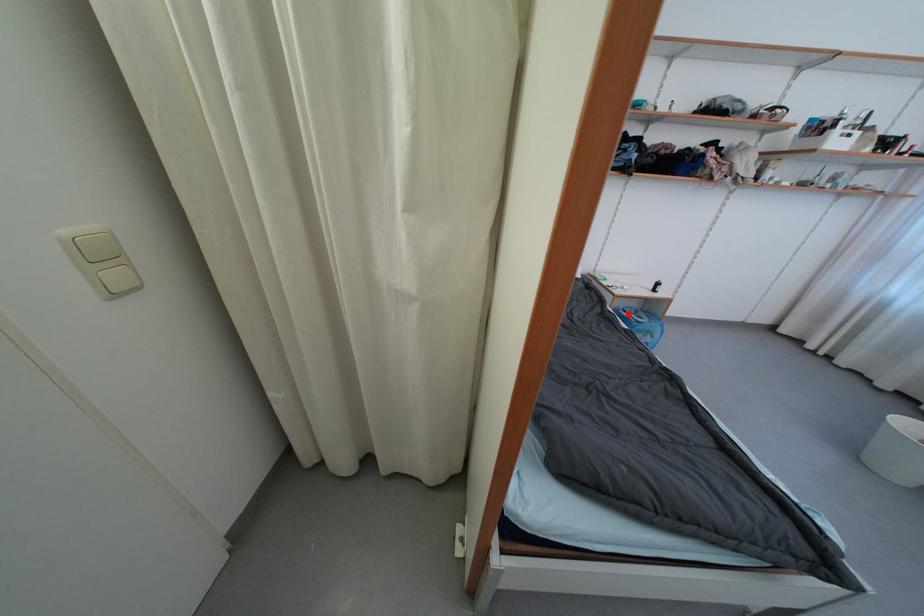
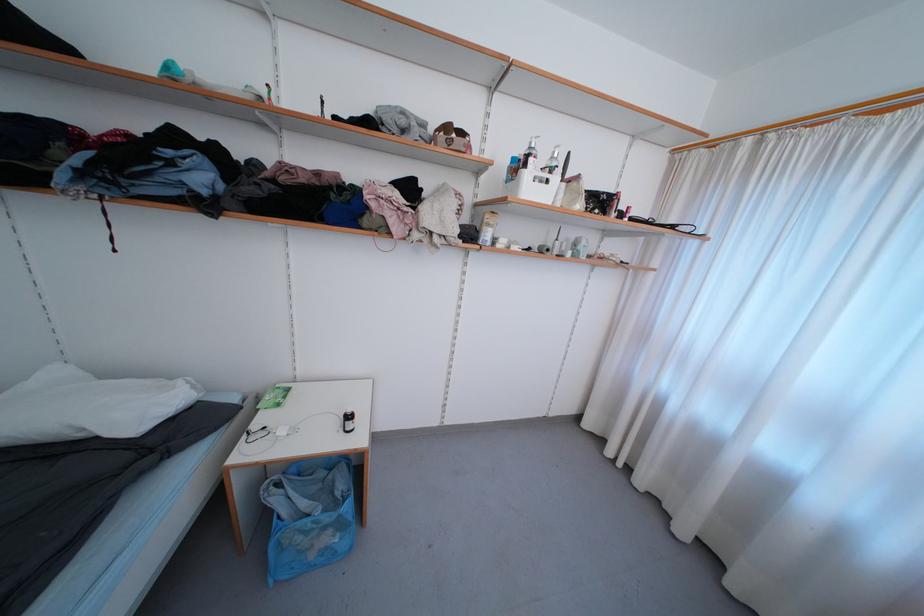
Find the pixel in the second image that matches the highlighted location in the first image.

(284, 488)